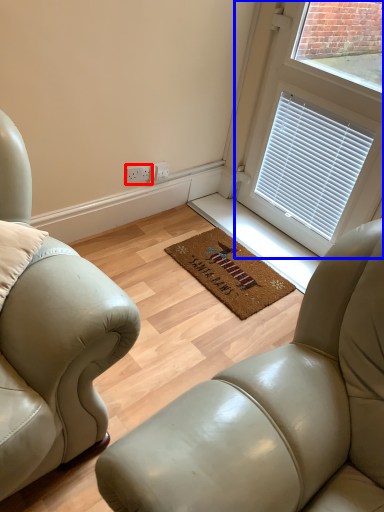
Question: Which object is further to the camera taking this photo, electric outlet (highlighted by a red box) or window (highlighted by a blue box)?

Choices:
 (A) electric outlet
 (B) window

Answer: (A)